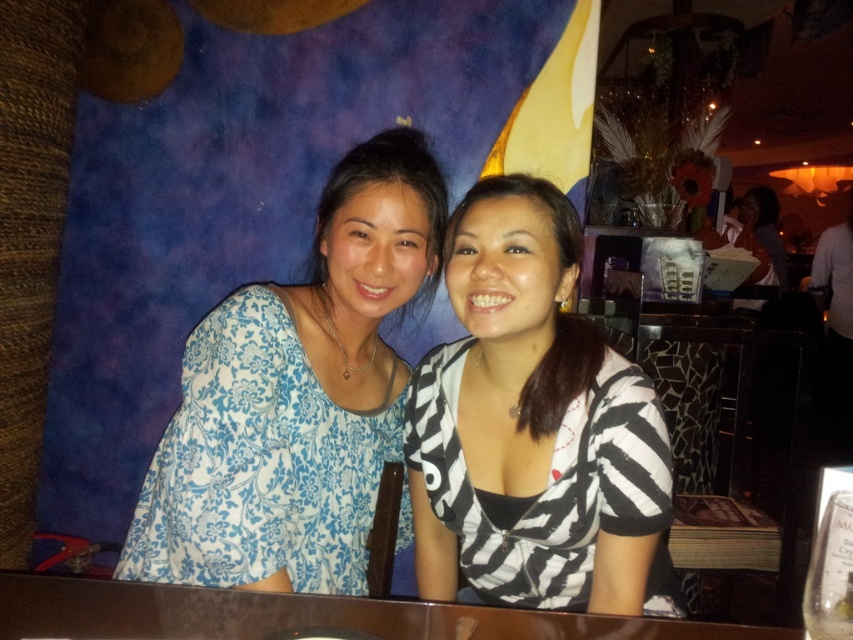
Question: Which object is positioned farthest from the zebra print blouse at center?

Choices:
 (A) brown wooden table at center
 (B) blue floral blouse at center

Answer: (A)

Question: Which point is closer to the camera taking this photo?

Choices:
 (A) coord(473,428)
 (B) coord(55,600)
 (C) coord(347,401)

Answer: (B)

Question: Can you confirm if blue floral blouse at center is wider than zebra print blouse at center?

Choices:
 (A) yes
 (B) no

Answer: (A)

Question: Is blue floral blouse at center above zebra print blouse at center?

Choices:
 (A) yes
 (B) no

Answer: (A)

Question: Is blue floral blouse at center wider than zebra print blouse at center?

Choices:
 (A) yes
 (B) no

Answer: (A)

Question: Based on their relative distances, which object is nearer to the blue floral blouse at center?

Choices:
 (A) zebra print blouse at center
 (B) brown wooden table at center

Answer: (A)